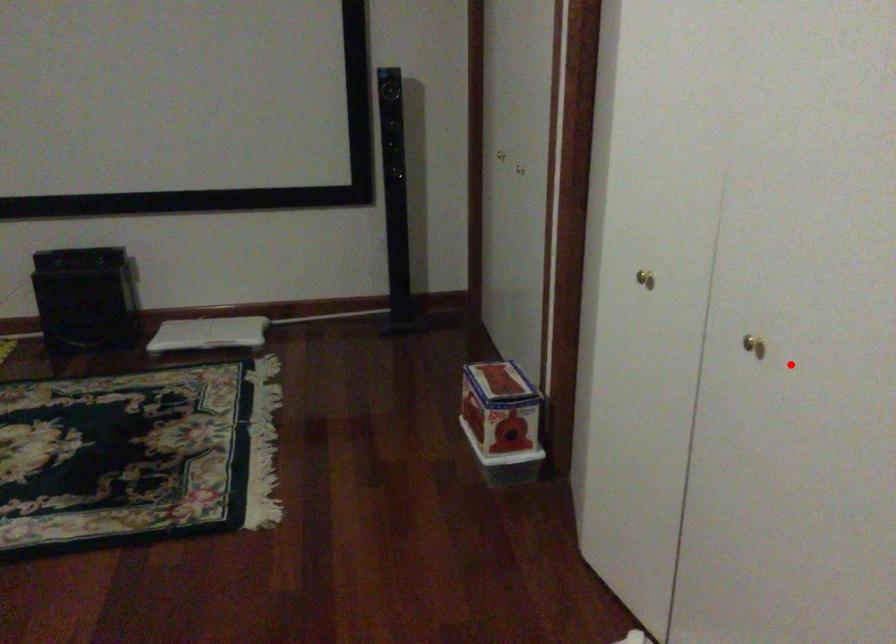
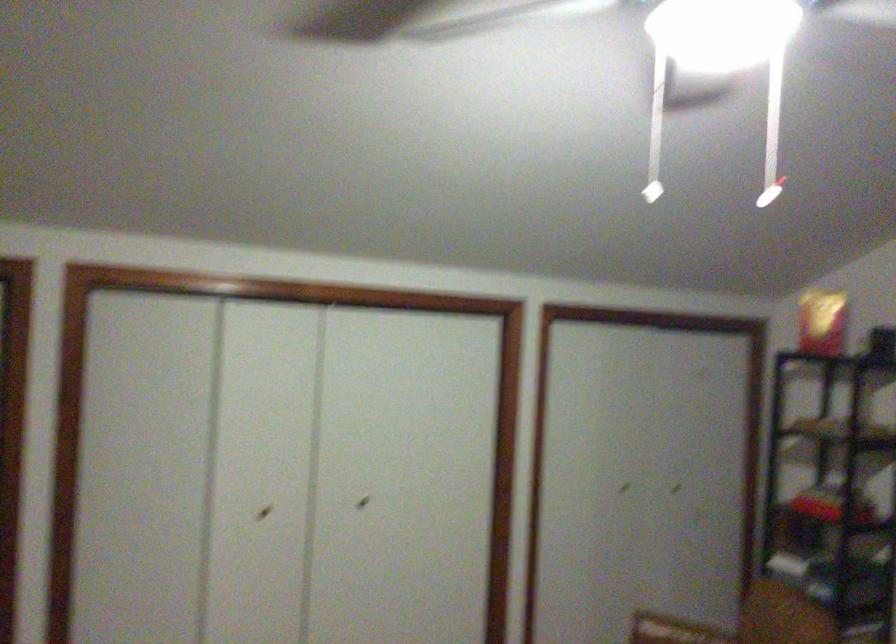
Question: A red point is marked in image1. In image2, is the corresponding 3D point closer to the camera or farther? Reply with the corresponding letter.

Choices:
 (A) The corresponding 3D point is closer.
 (B) The corresponding 3D point is farther.

Answer: (B)